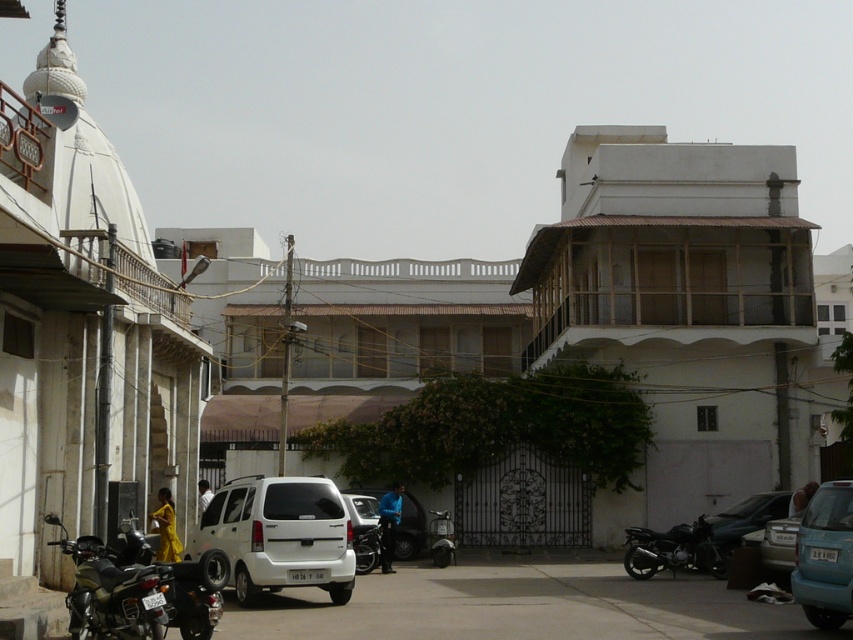
You are a delivery person needing to park your motorcycle. You see the metallic silver motorcycle at lower left and the shiny black motorcycle at center. Which motorcycle is parked higher up from the ground?

The metallic silver motorcycle at lower left is located above the shiny black motorcycle at center, so it is parked higher up from the ground.

You are a delivery person needing to choose between the metallic silver motorcycle at lower left and the shiny black motorcycle at center for a long trip. Which motorcycle should you choose based on size?

The metallic silver motorcycle at lower left is bigger than the shiny black motorcycle at center, so you should choose the metallic silver motorcycle at lower left for a long trip because it is larger and likely more spacious or capable for the journey.